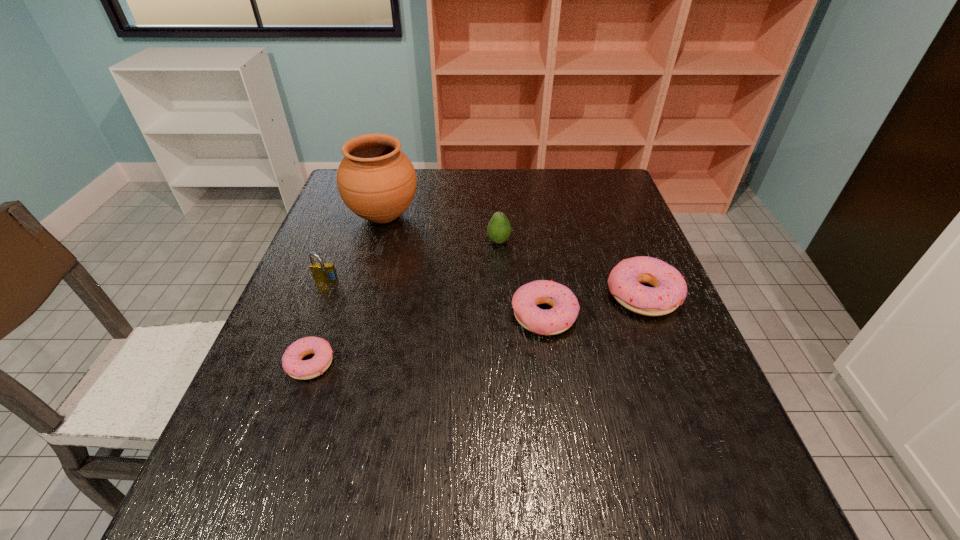
Find the location of a particular element. vacant region located on the front of the rightmost doughnut is located at coordinates (666, 355).

This screenshot has height=540, width=960. I want to click on free space located 0.360m on the right of the tallest object, so (542, 216).

Find the location of a particular element. Image resolution: width=960 pixels, height=540 pixels. free space located 0.220m on the side with the combination dials of the padlock is located at coordinates (296, 361).

Locate an element on the screen. This screenshot has width=960, height=540. vacant space situated on the back of the avocado is located at coordinates (496, 190).

The image size is (960, 540). Identify the location of object present at the far edge. [376, 180].

Identify the location of doughnut located in the left edge section of the desktop. This screenshot has height=540, width=960. (292, 363).

Identify the location of pottery that is at the left edge. (376, 180).

Locate an element on the screen. The image size is (960, 540). padlock at the left edge is located at coordinates click(322, 272).

What are the coordinates of `object that is at the right edge` in the screenshot? It's located at (669, 290).

Locate an element on the screen. Image resolution: width=960 pixels, height=540 pixels. object located at the far left corner is located at coordinates (376, 180).